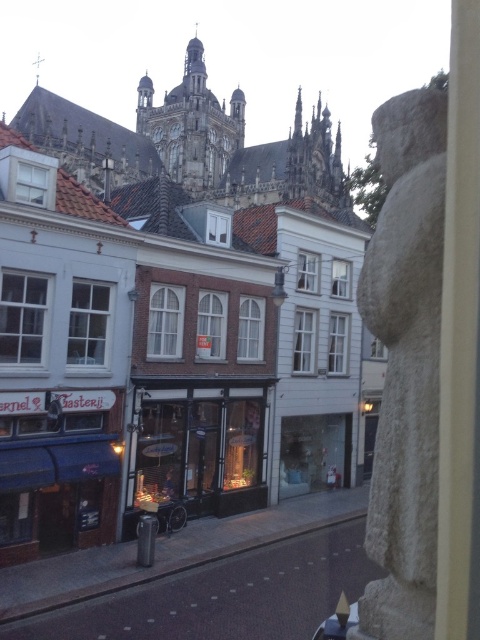
Question: Which object is positioned farthest from the white brick building at center?

Choices:
 (A) matte glass storefront at center
 (B) white stone statue at right

Answer: (B)

Question: Is white stone statue at right to the left of matte glass storefront at center from the viewer's perspective?

Choices:
 (A) no
 (B) yes

Answer: (A)

Question: Observing the image, what is the correct spatial positioning of white brick building at center in reference to white stone statue at right?

Choices:
 (A) above
 (B) below

Answer: (A)

Question: Among these objects, which one is farthest from the camera?

Choices:
 (A) white brick building at center
 (B) matte glass storefront at center
 (C) white stone statue at right

Answer: (B)

Question: Does white brick building at center lie in front of white stone statue at right?

Choices:
 (A) yes
 (B) no

Answer: (B)

Question: Which point is closer to the camera taking this photo?

Choices:
 (A) 201,109
 (B) 239,428
 (C) 408,236

Answer: (C)